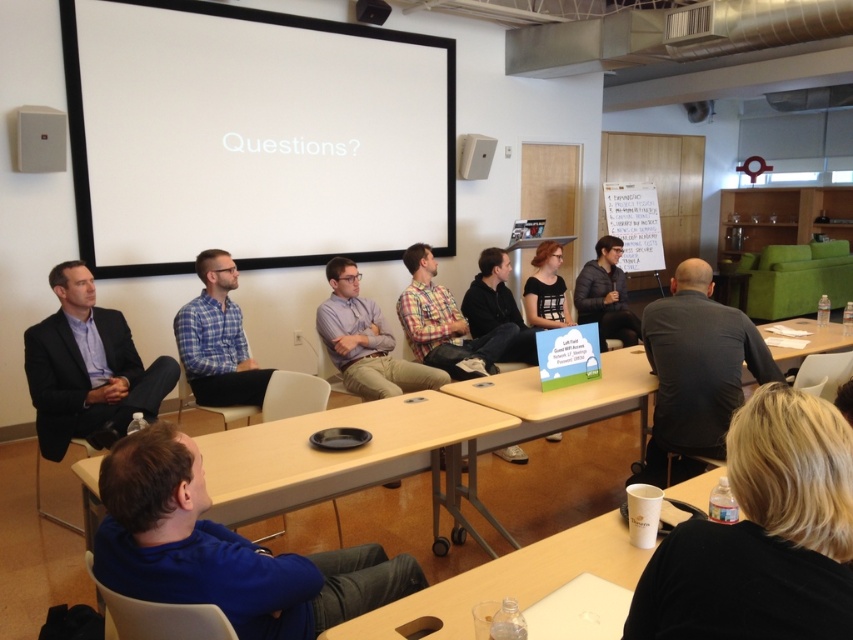
You are sitting at the back of the room and want to hand a document to both the blue fabric shirt at lower left and the plaid shirt at center. Which person should you approach first to ensure you can reach them without walking past the other?

You should approach the blue fabric shirt at lower left first because they are closer to you than the plaid shirt at center, so you can reach them without needing to walk past the other person.

You are attending a meeting and want to place a notebook on the white plastic table at lower center. However, there is a person wearing a black shirt at lower right near the table. Based on their positions, can you place the notebook on the table without disturbing them?

The black shirt at lower right is above the white plastic table at lower center, meaning the person is likely sitting or standing over the table. You should check if there is space available on the table next to them or ask if they need more room before placing the notebook to avoid disturbing them.

You are a photographer standing at the back of the room. You want to take a photo of the white plastic table at lower center without including the black shirt at lower right in the frame. Is this possible given their relative heights?

The black shirt at lower right is taller than the white plastic table at lower center. Since the photographer is at the back, the taller black shirt at lower right might block the view of the table. It might not be possible to capture the white plastic table at lower center without including the black shirt at lower right in the frame unless adjusting the angle or moving closer.